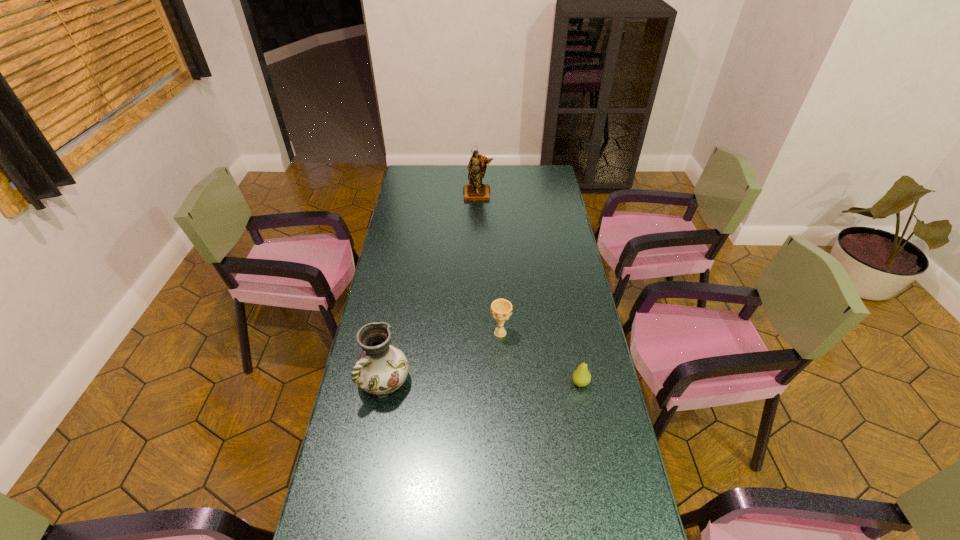
Find the location of a particular element. This screenshot has width=960, height=540. free point that satisfies the following two spatial constraints: 1. on the front side of the rightmost object; 2. on the left side of the leftmost object is located at coordinates (385, 382).

Where is `free spot that satisfies the following two spatial constraints: 1. on the front-facing side of the third nearest object; 2. on the right side of the farthest object`? free spot that satisfies the following two spatial constraints: 1. on the front-facing side of the third nearest object; 2. on the right side of the farthest object is located at coordinates (477, 333).

You are a GUI agent. You are given a task and a screenshot of the screen. Output one action in this format:
    pyautogui.click(x=<x>, y=<y>)
    Task: Click on the free space in the image that satisfies the following two spatial constraints: 1. on the front-facing side of the shortest object; 2. on the right side of the farthest object
    The width and height of the screenshot is (960, 540).
    Given the screenshot: What is the action you would take?
    pyautogui.click(x=477, y=382)